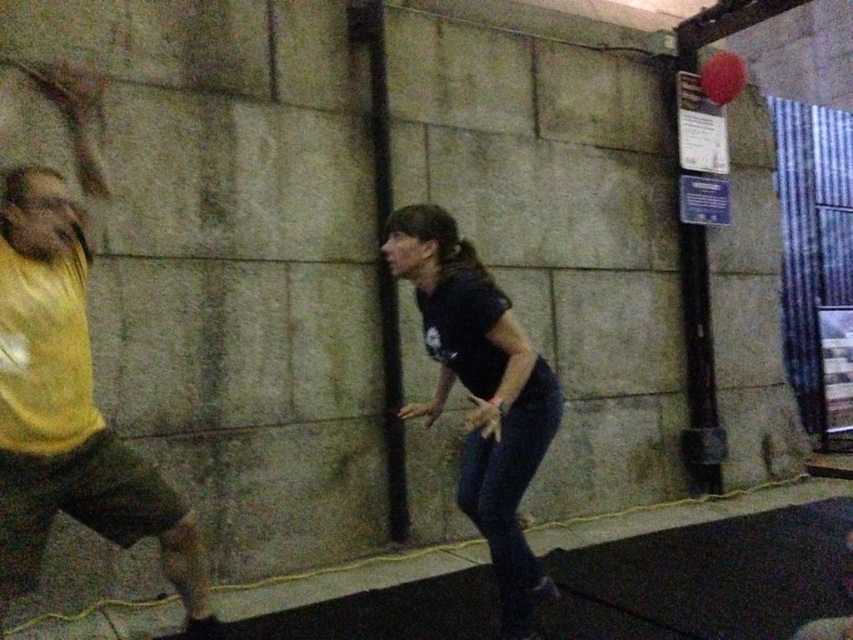
Is point (49, 333) farther from camera compared to point (457, 483)?

No, (49, 333) is closer to viewer.

Based on the photo, does yellow fabric shirt at left have a greater height compared to black matte shirt at center?

Yes.

Does point (73, 224) come behind point (398, 225)?

No, it is in front of (398, 225).

Locate an element on the screen. This screenshot has height=640, width=853. yellow fabric shirt at left is located at coordinates (68, 410).